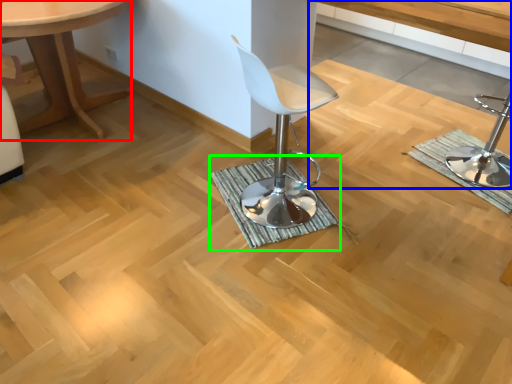
Question: Based on their relative distances, which object is farther from table (highlighted by a red box)? Choose from vanity (highlighted by a blue box) and bath mat (highlighted by a green box).

Choices:
 (A) vanity
 (B) bath mat

Answer: (A)